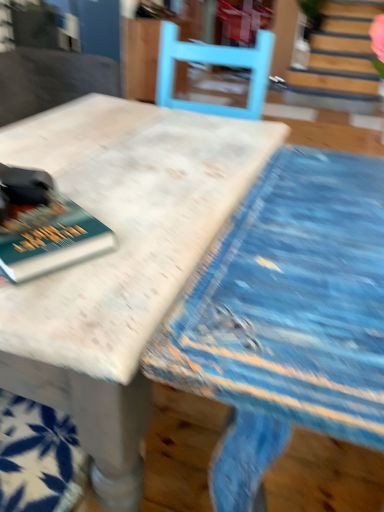
You are a GUI agent. You are given a task and a screenshot of the screen. Output one action in this format:
    pyautogui.click(x=<x>, y=<y>)
    Task: Click on the free point above hardcover book at left (from a real-world perspective)
    
    Given the screenshot: What is the action you would take?
    pyautogui.click(x=37, y=213)